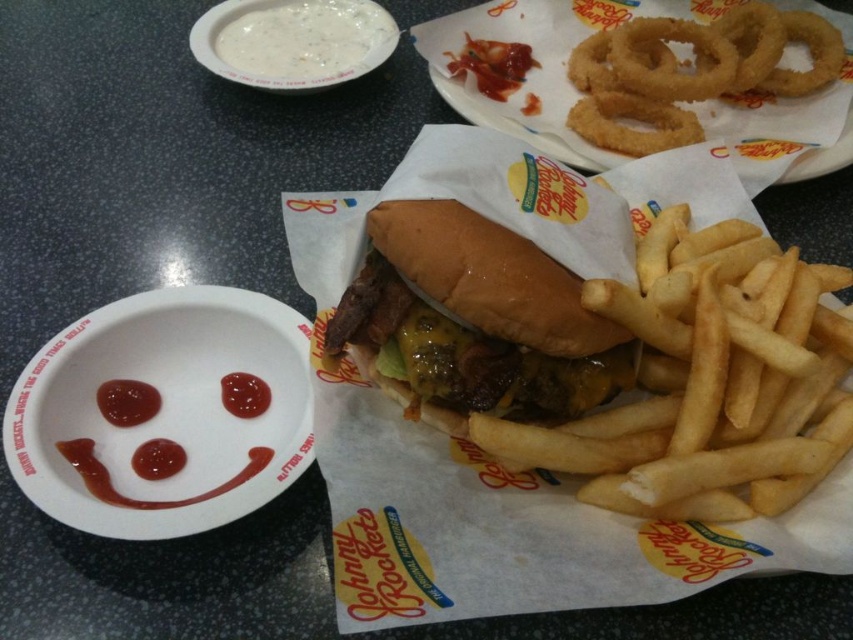
Does golden crispy french fries at center have a lesser width compared to white matte bowl at upper left?

No.

Which is behind, point (698, 467) or point (299, 61)?

Point (299, 61)

Describe the element at coordinates (706, 381) in the screenshot. This screenshot has height=640, width=853. I see `golden crispy french fries at center` at that location.

Where is `golden crispy french fries at center`? The image size is (853, 640). golden crispy french fries at center is located at coordinates (706, 381).

Which is behind, point (105, 330) or point (520, 138)?

The point (520, 138) is behind.

How distant is matte white paper plate at lower left from golden brown fried onion rings at upper center?

matte white paper plate at lower left is 56.70 centimeters away from golden brown fried onion rings at upper center.

Which is in front, point (134, 435) or point (843, 132)?

Positioned in front is point (134, 435).

At what (x,y) coordinates should I click in order to perform the action: click on matte white paper plate at lower left. Please return your answer as a coordinate pair (x, y). Image resolution: width=853 pixels, height=640 pixels. Looking at the image, I should click on (167, 412).

Which is more to the right, golden crispy french fries at center or slightly toasted bun at center?

golden crispy french fries at center is more to the right.

Can you confirm if golden crispy french fries at center is positioned to the right of slightly toasted bun at center?

Yes, golden crispy french fries at center is to the right of slightly toasted bun at center.

Between point (782, 451) and point (553, 276), which one is positioned in front?

Point (782, 451) is in front.

The image size is (853, 640). Find the location of `golden crispy french fries at center`. golden crispy french fries at center is located at coordinates (706, 381).